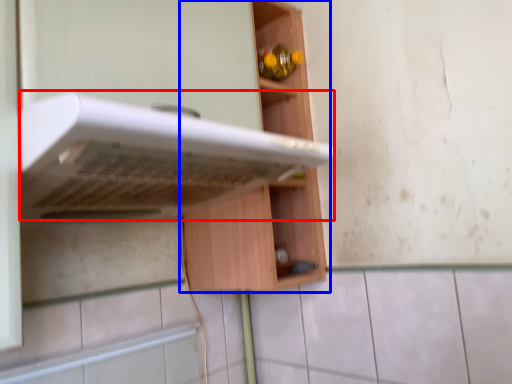
Question: Among these objects, which one is nearest to the camera, oven (highlighted by a red box) or cabinetry (highlighted by a blue box)?

Choices:
 (A) oven
 (B) cabinetry

Answer: (A)